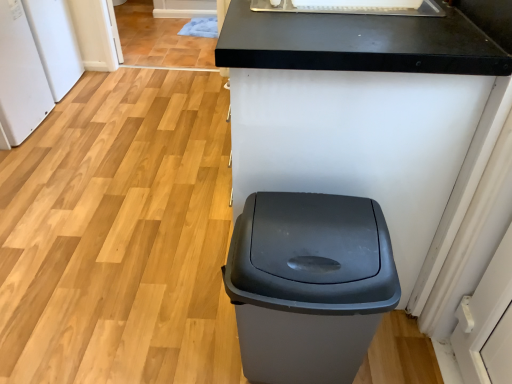
In order to click on free space above white glossy sink at upper center (from a real-world perspective) in this screenshot , I will do `click(369, 3)`.